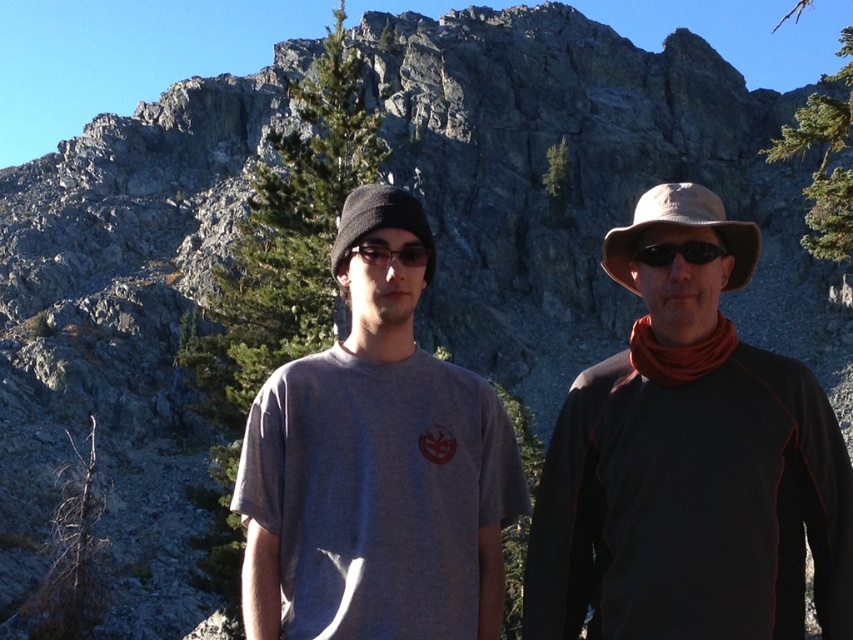
Is gray cotton t-shirt at center smaller than green leafy pine at center?

Yes, gray cotton t-shirt at center is smaller than green leafy pine at center.

The width and height of the screenshot is (853, 640). What do you see at coordinates (376, 467) in the screenshot? I see `gray cotton t-shirt at center` at bounding box center [376, 467].

The height and width of the screenshot is (640, 853). I want to click on gray cotton t-shirt at center, so click(376, 467).

Find the location of a particular element. This screenshot has height=640, width=853. gray cotton t-shirt at center is located at coordinates (376, 467).

Does gray cotton t-shirt at center have a lesser width compared to green textured pine at upper right?

Indeed, gray cotton t-shirt at center has a lesser width compared to green textured pine at upper right.

In the scene shown: Is gray cotton t-shirt at center closer to the viewer compared to green textured pine at upper right?

Yes, it is.

Describe the element at coordinates (376, 467) in the screenshot. This screenshot has height=640, width=853. I see `gray cotton t-shirt at center` at that location.

I want to click on gray cotton t-shirt at center, so click(376, 467).

Between black matte sunglasses at center and sunglasses at center, which one has less height?

With less height is black matte sunglasses at center.

Is black matte sunglasses at center closer to the viewer compared to sunglasses at center?

Yes, it is in front of sunglasses at center.

Between point (662, 252) and point (370, 243), which one is positioned in front?

Point (662, 252)

Find the location of a particular element. This screenshot has height=640, width=853. black matte sunglasses at center is located at coordinates (677, 252).